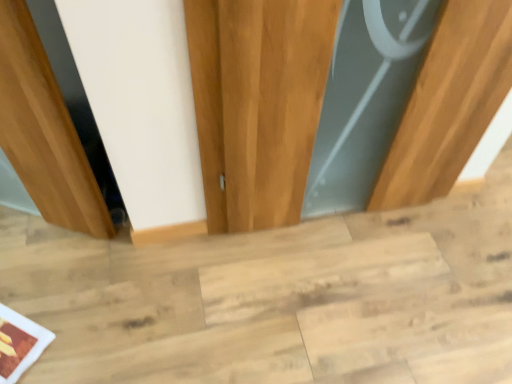
Question: In the image, is wooden door at center positioned in front of or behind light wood stair at center?

Choices:
 (A) front
 (B) behind

Answer: (A)

Question: Choose the correct answer: Is wooden door at center inside light wood stair at center or outside it?

Choices:
 (A) inside
 (B) outside

Answer: (B)

Question: Looking at the image, does wooden door at center seem bigger or smaller compared to light wood stair at center?

Choices:
 (A) small
 (B) big

Answer: (A)

Question: Is light wood stair at center taller or shorter than wooden door at center?

Choices:
 (A) short
 (B) tall

Answer: (A)

Question: Considering the positions of point (399, 375) and point (265, 79), is point (399, 375) closer or farther from the camera than point (265, 79)?

Choices:
 (A) farther
 (B) closer

Answer: (A)

Question: Is light wood stair at center bigger or smaller than wooden door at center?

Choices:
 (A) small
 (B) big

Answer: (B)

Question: Is light wood stair at center in front of or behind wooden door at center in the image?

Choices:
 (A) front
 (B) behind

Answer: (B)